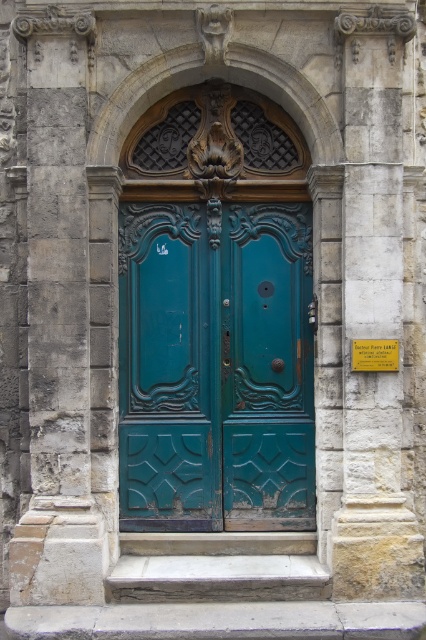
Between teal carved wood door at center and stone textured pillar at right, which one is positioned higher?

stone textured pillar at right is higher up.

Does point (176, 344) come behind point (382, 74)?

Yes, it is.

Who is more distant from viewer, [178,461] or [408,593]?

The point [178,461] is behind.

Find the location of a particular element. teal carved wood door at center is located at coordinates (215, 368).